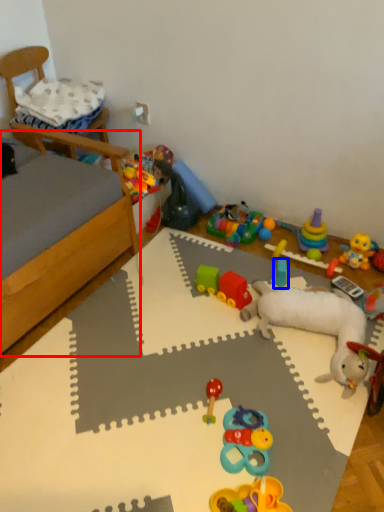
Question: Which object is further to the camera taking this photo, bed frame (highlighted by a red box) or toy (highlighted by a blue box)?

Choices:
 (A) bed frame
 (B) toy

Answer: (B)